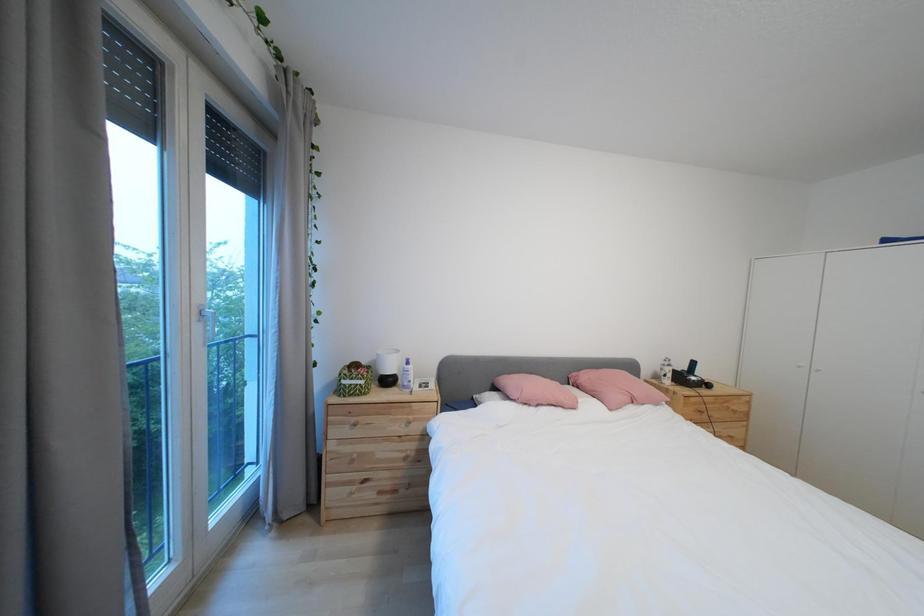
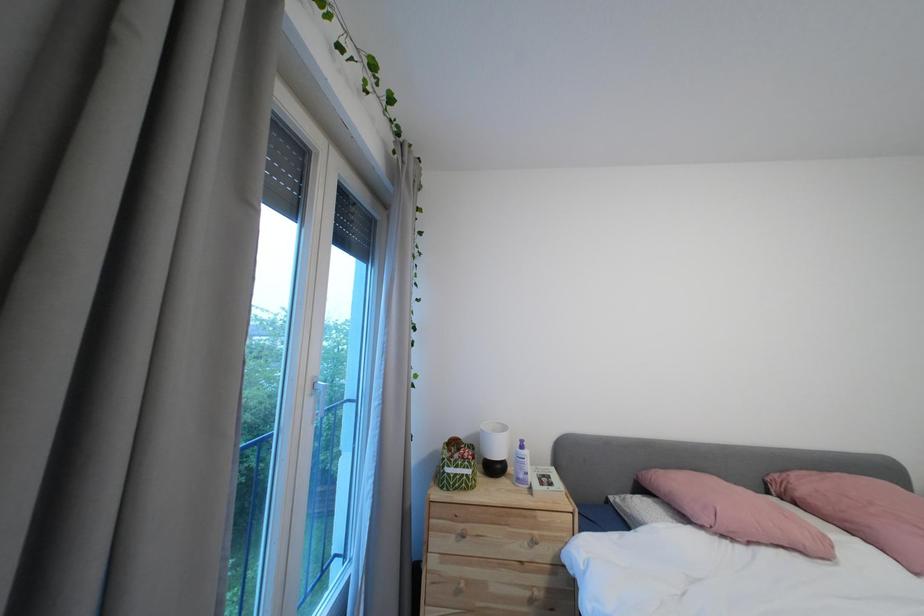
Consider the image. Which direction would the cameraman need to move to produce the second image?

The cameraman walked toward left, forward.